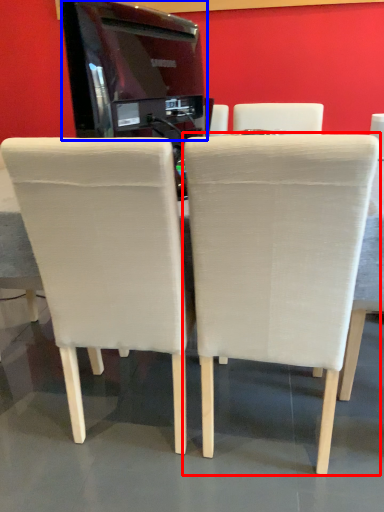
Question: Which point is closer to the camera, chair (highlighted by a red box) or appliance (highlighted by a blue box)?

Choices:
 (A) chair
 (B) appliance

Answer: (A)